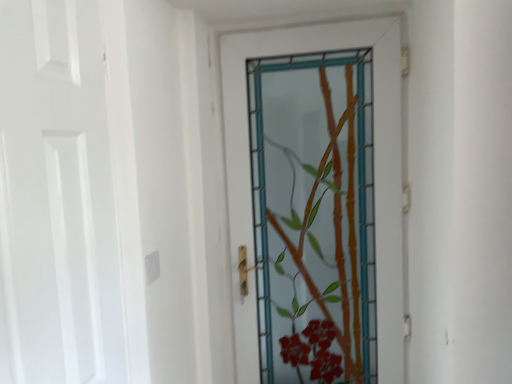
Identify the location of translucent glass bamboo at center, placed as the 1th door when sorted from right to left. (374, 171).

This screenshot has width=512, height=384. Describe the element at coordinates (374, 171) in the screenshot. I see `translucent glass bamboo at center, placed as the 1th door when sorted from right to left` at that location.

Identify the location of white matte door at left, which is the first door in front-to-back order. (56, 199).

This screenshot has width=512, height=384. What do you see at coordinates (56, 199) in the screenshot? I see `white matte door at left, the 2th door in the right-to-left sequence` at bounding box center [56, 199].

At what (x,y) coordinates should I click in order to perform the action: click on translucent glass bamboo at center, the second door positioned from the left. Please return your answer as a coordinate pair (x, y). This screenshot has width=512, height=384. Looking at the image, I should click on (374, 171).

Which object is positioned more to the right, white matte door at left, the 1th door viewed from the left, or translucent glass bamboo at center, the second door positioned from the left?

translucent glass bamboo at center, the second door positioned from the left, is more to the right.

Which object is more forward, white matte door at left, which is the first door in front-to-back order, or translucent glass bamboo at center, the second door positioned from the left?

white matte door at left, which is the first door in front-to-back order, is closer to the camera.

Is point (68, 200) positioned in front of point (249, 184)?

Yes, it is in front of point (249, 184).

From the image's perspective, which one is positioned higher, white matte door at left, the 2th door from the back, or translucent glass bamboo at center, the second door positioned from the left?

white matte door at left, the 2th door from the back, from the image's perspective.

From a real-world perspective, which object rests below the other?

translucent glass bamboo at center, acting as the 2th door starting from the front.

Which of these two, white matte door at left, which is the first door in front-to-back order, or translucent glass bamboo at center, the second door positioned from the left, is wider?

translucent glass bamboo at center, the second door positioned from the left.

Considering the sizes of white matte door at left, the 1th door viewed from the left, and translucent glass bamboo at center, placed as the 1th door when sorted from right to left, in the image, is white matte door at left, the 1th door viewed from the left, taller or shorter than translucent glass bamboo at center, placed as the 1th door when sorted from right to left,?

Considering their sizes, white matte door at left, the 1th door viewed from the left, has less height than translucent glass bamboo at center, placed as the 1th door when sorted from right to left.

In terms of size, does white matte door at left, the 1th door viewed from the left, appear bigger or smaller than translucent glass bamboo at center, placed as the 1th door when sorted from right to left?

white matte door at left, the 1th door viewed from the left, is smaller than translucent glass bamboo at center, placed as the 1th door when sorted from right to left.

Is white matte door at left, which is the first door in front-to-back order, not inside translucent glass bamboo at center, the second door positioned from the left?

Yes.

Is white matte door at left, the 2th door in the right-to-left sequence, not near translucent glass bamboo at center, the second door positioned from the left?

Actually, white matte door at left, the 2th door in the right-to-left sequence, and translucent glass bamboo at center, the second door positioned from the left, are a little close together.

Is translucent glass bamboo at center, which appears as the 1th door when viewed from the back, at the back of white matte door at left, the 2th door from the back?

white matte door at left, the 2th door from the back, is not turned away from translucent glass bamboo at center, which appears as the 1th door when viewed from the back.

How many degrees apart are the facing directions of white matte door at left, the 2th door from the back, and translucent glass bamboo at center, the second door positioned from the left?

They differ by 89.1 degrees in their facing directions.

Image resolution: width=512 pixels, height=384 pixels. Identify the location of door below the white matte door at left, the 2th door in the right-to-left sequence (from the image's perspective). (374, 171).

Between translucent glass bamboo at center, the second door positioned from the left, and white matte door at left, the 2th door from the back, which one appears on the left side from the viewer's perspective?

white matte door at left, the 2th door from the back.

Relative to white matte door at left, the 2th door from the back, is translucent glass bamboo at center, the second door positioned from the left, in front or behind?

In the image, translucent glass bamboo at center, the second door positioned from the left, appears behind white matte door at left, the 2th door from the back.

Is point (305, 40) closer to viewer compared to point (37, 74)?

That is False.

From the image's perspective, does translucent glass bamboo at center, which appears as the 1th door when viewed from the back, appear higher than white matte door at left, the 2th door from the back?

No, from the image's perspective, translucent glass bamboo at center, which appears as the 1th door when viewed from the back, is not on top of white matte door at left, the 2th door from the back.

From a real-world perspective, does translucent glass bamboo at center, the second door positioned from the left, sit lower than white matte door at left, the 2th door in the right-to-left sequence?

Indeed, from a real-world perspective, translucent glass bamboo at center, the second door positioned from the left, is positioned beneath white matte door at left, the 2th door in the right-to-left sequence.

Can you confirm if translucent glass bamboo at center, acting as the 2th door starting from the front, is wider than white matte door at left, the 2th door in the right-to-left sequence?

Yes.

Can you confirm if translucent glass bamboo at center, placed as the 1th door when sorted from right to left, is taller than white matte door at left, the 2th door from the back?

Correct, translucent glass bamboo at center, placed as the 1th door when sorted from right to left, is much taller as white matte door at left, the 2th door from the back.

Considering the sizes of translucent glass bamboo at center, placed as the 1th door when sorted from right to left, and white matte door at left, the 1th door viewed from the left, in the image, is translucent glass bamboo at center, placed as the 1th door when sorted from right to left, bigger or smaller than white matte door at left, the 1th door viewed from the left,?

Clearly, translucent glass bamboo at center, placed as the 1th door when sorted from right to left, is larger in size than white matte door at left, the 1th door viewed from the left.

Is translucent glass bamboo at center, placed as the 1th door when sorted from right to left, spatially inside white matte door at left, which is the first door in front-to-back order, or outside of it?

The correct answer is: outside.

Is translucent glass bamboo at center, the second door positioned from the left, not close to white matte door at left, the 2th door from the back?

They are positioned close to each other.

Is translucent glass bamboo at center, which appears as the 1th door when viewed from the back, facing away from white matte door at left, which is the first door in front-to-back order?

No, translucent glass bamboo at center, which appears as the 1th door when viewed from the back, is not facing the opposite direction of white matte door at left, which is the first door in front-to-back order.

How many degrees apart are the facing directions of translucent glass bamboo at center, the second door positioned from the left, and white matte door at left, the 2th door in the right-to-left sequence?

They differ by 89.1 degrees in their facing directions.

Where is `door above the translucent glass bamboo at center, acting as the 2th door starting from the front (from the image's perspective)`? This screenshot has height=384, width=512. door above the translucent glass bamboo at center, acting as the 2th door starting from the front (from the image's perspective) is located at coordinates (56, 199).

Identify the location of door behind the white matte door at left, which is the first door in front-to-back order. This screenshot has width=512, height=384. (374, 171).

The width and height of the screenshot is (512, 384). Identify the location of door on the right of white matte door at left, the 1th door viewed from the left. [374, 171].